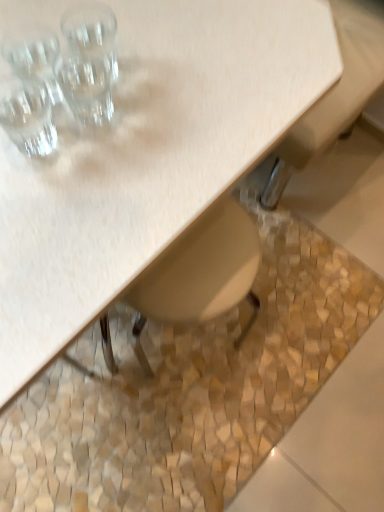
Question: Considering the relative sizes of matte wood table at upper left and clear glass shot glass at upper left, which appears as the 1th shot glass when ordered from the bottom, in the image provided, is matte wood table at upper left thinner than clear glass shot glass at upper left, which appears as the 1th shot glass when ordered from the bottom,?

Choices:
 (A) yes
 (B) no

Answer: (B)

Question: From the image's perspective, does matte wood table at upper left appear lower than clear glass shot glass at upper left, which appears as the 1th shot glass when ordered from the bottom?

Choices:
 (A) yes
 (B) no

Answer: (A)

Question: Is matte wood table at upper left shorter than clear glass shot glass at upper left, the 3th shot glass from the top?

Choices:
 (A) no
 (B) yes

Answer: (A)

Question: Is matte wood table at upper left not inside clear glass shot glass at upper left, the 3th shot glass from the top?

Choices:
 (A) yes
 (B) no

Answer: (A)

Question: Is matte wood table at upper left turned away from clear glass shot glass at upper left, the 3th shot glass from the top?

Choices:
 (A) no
 (B) yes

Answer: (A)

Question: Does point (33, 101) appear closer or farther from the camera than point (69, 102)?

Choices:
 (A) closer
 (B) farther

Answer: (A)

Question: Considering the relative positions of clear glass shot glass at upper left, the 3th shot glass from the top, and transparent glass at upper left, the 2th shot glass when ordered from top to bottom, in the image provided, is clear glass shot glass at upper left, the 3th shot glass from the top, to the left or to the right of transparent glass at upper left, the 2th shot glass when ordered from top to bottom,?

Choices:
 (A) left
 (B) right

Answer: (A)

Question: Is clear glass shot glass at upper left, the 3th shot glass from the top, bigger or smaller than transparent glass at upper left, positioned as the 2th shot glass in bottom-to-top order?

Choices:
 (A) small
 (B) big

Answer: (A)

Question: Is clear glass shot glass at upper left, which appears as the 1th shot glass when ordered from the bottom, inside or outside of transparent glass at upper left, positioned as the 2th shot glass in bottom-to-top order?

Choices:
 (A) outside
 (B) inside

Answer: (A)

Question: Relative to matte wood table at upper left, is clear glass shot glass at upper left, the 3th shot glass from the top, in front or behind?

Choices:
 (A) front
 (B) behind

Answer: (B)

Question: Considering the positions of clear glass shot glass at upper left, the 3th shot glass from the top, and matte wood table at upper left in the image, is clear glass shot glass at upper left, the 3th shot glass from the top, wider or thinner than matte wood table at upper left?

Choices:
 (A) thin
 (B) wide

Answer: (A)

Question: From the image's perspective, is clear glass shot glass at upper left, the 3th shot glass from the top, positioned above or below matte wood table at upper left?

Choices:
 (A) below
 (B) above

Answer: (B)

Question: Visually, is clear glass shot glass at upper left, which appears as the 1th shot glass when ordered from the bottom, positioned to the left or to the right of matte wood table at upper left?

Choices:
 (A) left
 (B) right

Answer: (B)

Question: From the image's perspective, is matte wood table at upper left positioned above or below clear glass shot glass at upper left, which appears as the 1th shot glass when ordered from the bottom?

Choices:
 (A) above
 (B) below

Answer: (B)

Question: Based on their positions, is matte wood table at upper left located to the left or right of clear glass shot glass at upper left, which appears as the 1th shot glass when ordered from the bottom?

Choices:
 (A) right
 (B) left

Answer: (B)